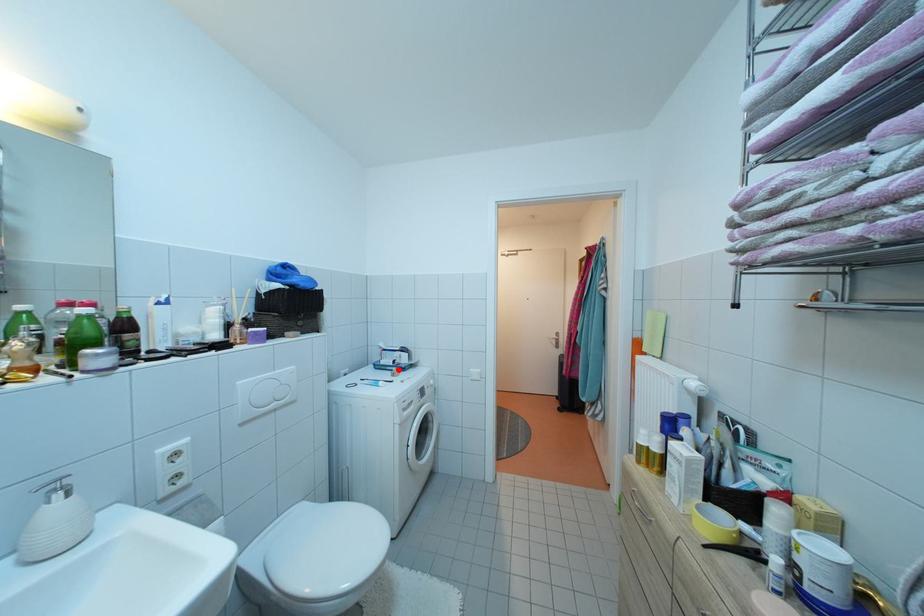
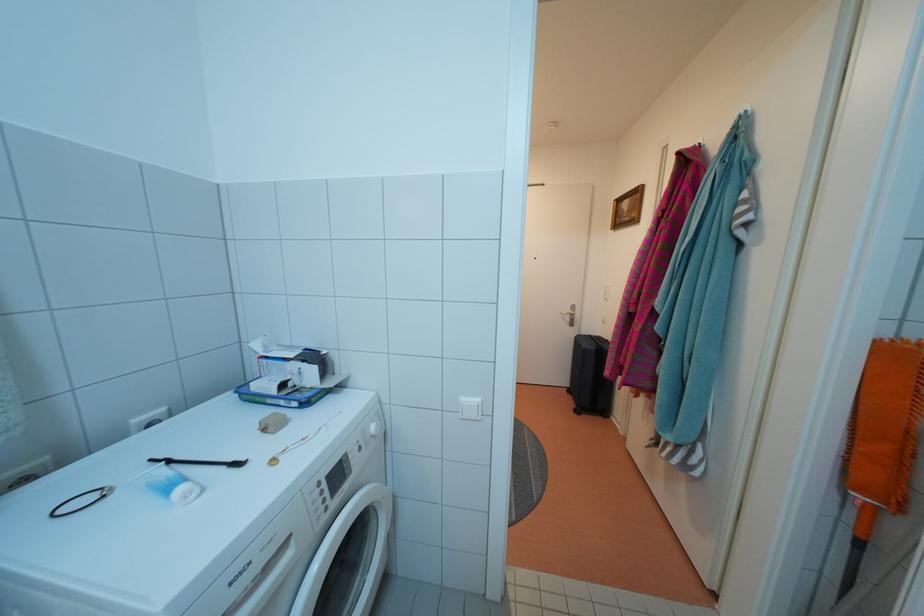
Find the pixel in the second image that matches the highlighted location in the first image.

(282, 398)